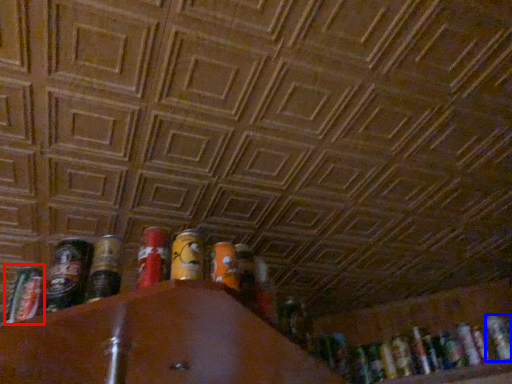
Question: Among these objects, which one is nearest to the camera, spray can (highlighted by a red box) or beer (highlighted by a blue box)?

Choices:
 (A) spray can
 (B) beer

Answer: (A)